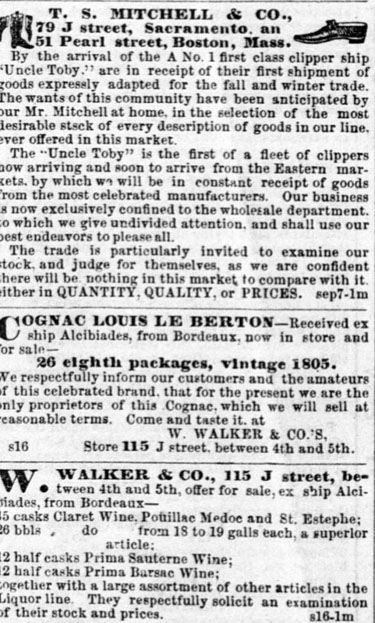
Identify the location of newspaper. (191, 234).